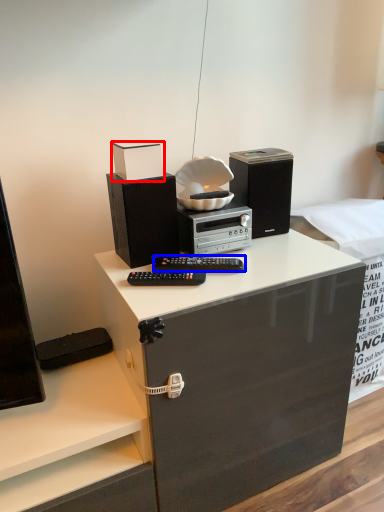
Question: Which point is closer to the camera, box (highlighted by a red box) or audio (highlighted by a blue box)?

Choices:
 (A) box
 (B) audio

Answer: (A)